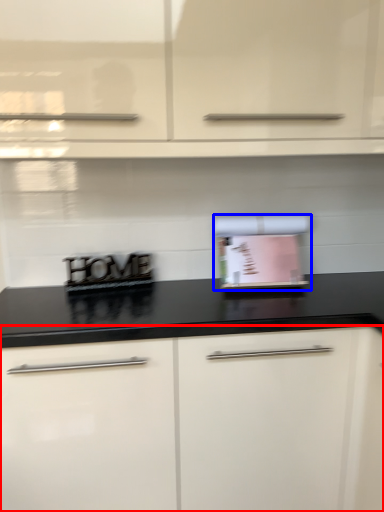
Question: Which object appears farthest to the camera in this image, cabinetry (highlighted by a red box) or appliance (highlighted by a blue box)?

Choices:
 (A) cabinetry
 (B) appliance

Answer: (B)